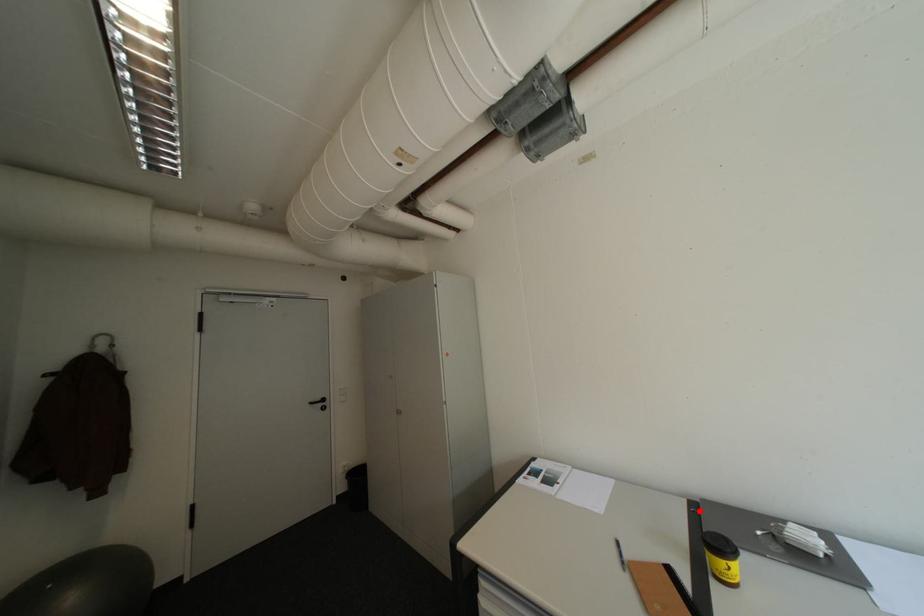
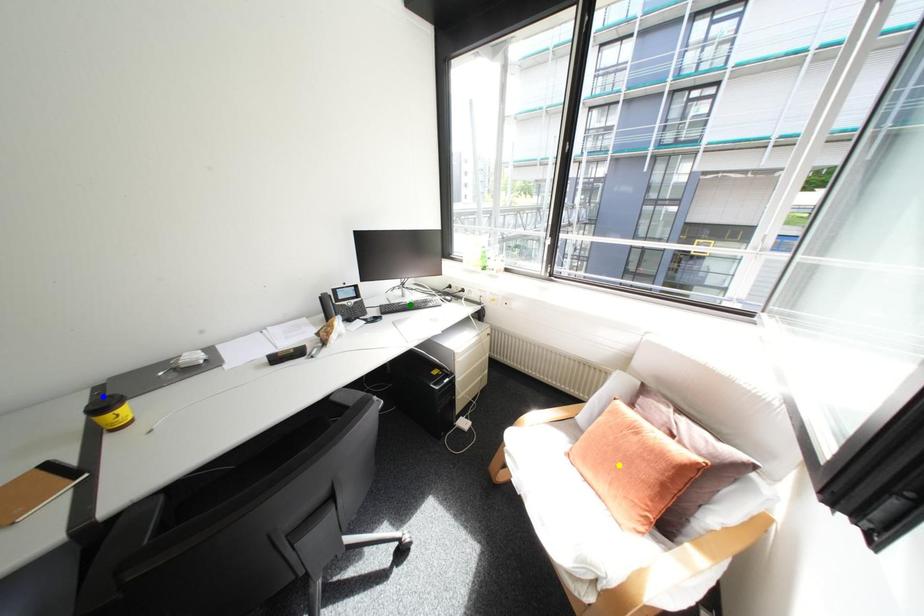
Question: I am providing you with two images of the same scene from different viewpoints. A red point is marked on the first image. You are given multiple points on the second image. Which mark in image 2 goes with the point in image 1?

Choices:
 (A) yellow point
 (B) blue point
 (C) green point

Answer: (B)